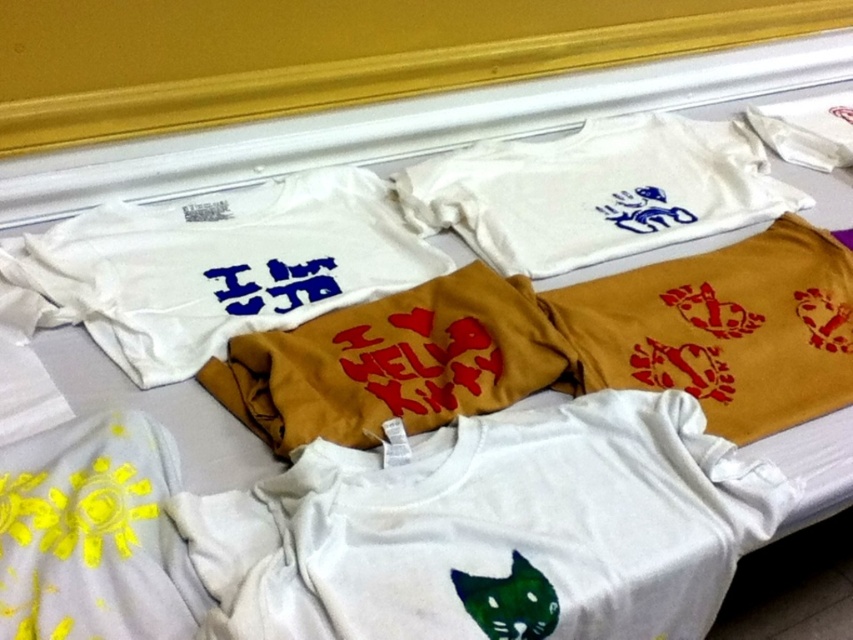
You are standing in front of the t shirts and want to pick up the shirt at point (621,536). Will you need to move the shirt at point (473,390) first?

Point (621,536) is in front of point (473,390), so you do not need to move the shirt at point (473,390) first.